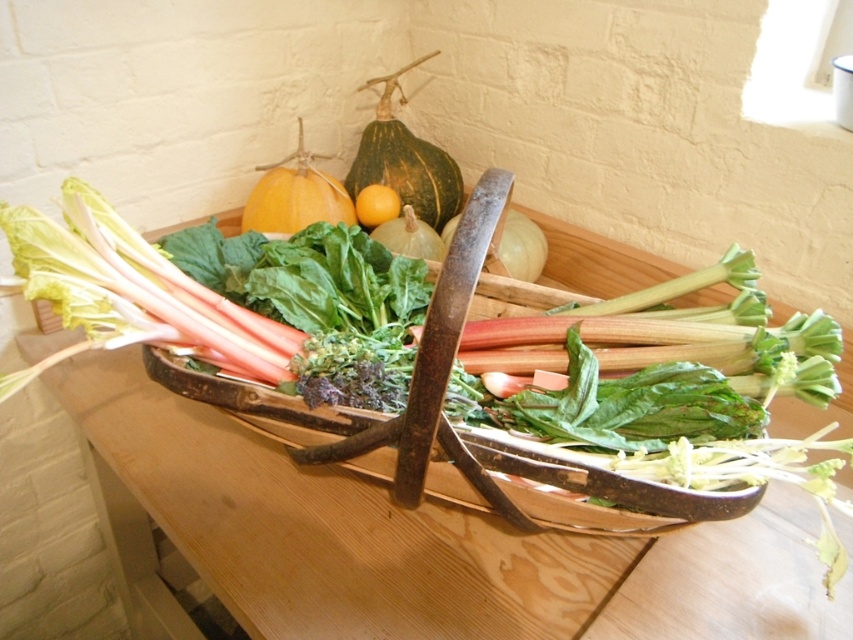
You are arranging vegetables in the basket and need to know the position of the smooth orange squash at upper center and the yellow smooth orange at center. Which one is placed higher in the basket?

The smooth orange squash at upper center is placed higher in the basket than the yellow smooth orange at center.

You are standing in front of the rustic wooden basket and want to reach for an item. If you extend your hand towards the point at coordinates point (398, 129) and point (355, 220), which point will your hand touch first?

Point (398, 129) is further to the camera than point (355, 220), so your hand will touch point (355, 220) first.